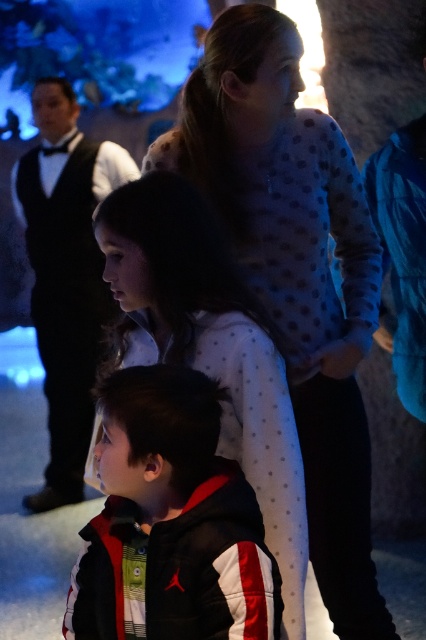
Question: Can you confirm if white dotted sweater at upper center is positioned above white dotted shirt at upper center?

Choices:
 (A) yes
 (B) no

Answer: (A)

Question: Is white dotted sweater at upper center positioned in front of black and white jacket at lower center?

Choices:
 (A) yes
 (B) no

Answer: (B)

Question: Can you confirm if white dotted sweater at upper center is positioned below black and white jacket at lower center?

Choices:
 (A) yes
 (B) no

Answer: (B)

Question: Which of these objects is positioned closest to the white dotted sweater at upper center?

Choices:
 (A) black and white jacket at lower center
 (B) white dotted shirt at upper center

Answer: (B)

Question: Which of these objects is positioned farthest from the black and white jacket at lower center?

Choices:
 (A) white dotted sweater at upper center
 (B) white dotted shirt at upper center

Answer: (A)

Question: Which of these objects is positioned closest to the white dotted sweater at upper center?

Choices:
 (A) white dotted shirt at upper center
 (B) black and white jacket at lower center

Answer: (A)